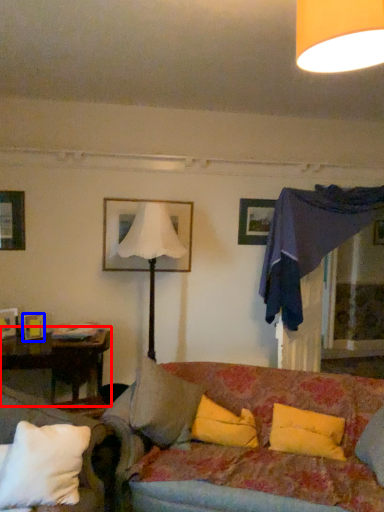
Question: Which point is closer to the camera, table (highlighted by a red box) or picture frame (highlighted by a blue box)?

Choices:
 (A) table
 (B) picture frame

Answer: (A)